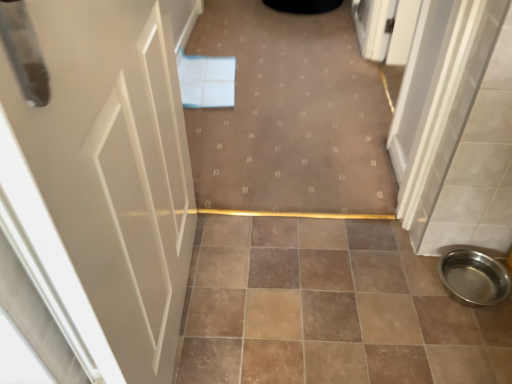
Question: Should I look upward or downward to see white glossy door at left?

Choices:
 (A) down
 (B) up

Answer: (A)

Question: Is carpet at center facing away from white glossy door at left?

Choices:
 (A) yes
 (B) no

Answer: (B)

Question: Is carpet at center to the left of white glossy door at left from the viewer's perspective?

Choices:
 (A) no
 (B) yes

Answer: (A)

Question: Does carpet at center appear on the right side of white glossy door at left?

Choices:
 (A) yes
 (B) no

Answer: (A)

Question: Would you say carpet at center is outside white glossy door at left?

Choices:
 (A) no
 (B) yes

Answer: (B)

Question: Does carpet at center lie in front of white glossy door at left?

Choices:
 (A) no
 (B) yes

Answer: (A)

Question: Does carpet at center have a lesser height compared to white glossy door at left?

Choices:
 (A) no
 (B) yes

Answer: (B)

Question: From the image's perspective, would you say polished stainless steel bowl at lower right is positioned over white glossy door at left?

Choices:
 (A) no
 (B) yes

Answer: (A)

Question: Can you see polished stainless steel bowl at lower right touching white glossy door at left?

Choices:
 (A) yes
 (B) no

Answer: (B)

Question: Is polished stainless steel bowl at lower right looking in the opposite direction of white glossy door at left?

Choices:
 (A) yes
 (B) no

Answer: (B)

Question: From a real-world perspective, is polished stainless steel bowl at lower right on top of white glossy door at left?

Choices:
 (A) no
 (B) yes

Answer: (A)

Question: Is polished stainless steel bowl at lower right at the right side of white glossy door at left?

Choices:
 (A) no
 (B) yes

Answer: (B)

Question: Is white glossy door at left a part of polished stainless steel bowl at lower right?

Choices:
 (A) no
 (B) yes

Answer: (A)

Question: Does white glossy door at left lie behind brown ceramic tile at center?

Choices:
 (A) no
 (B) yes

Answer: (A)